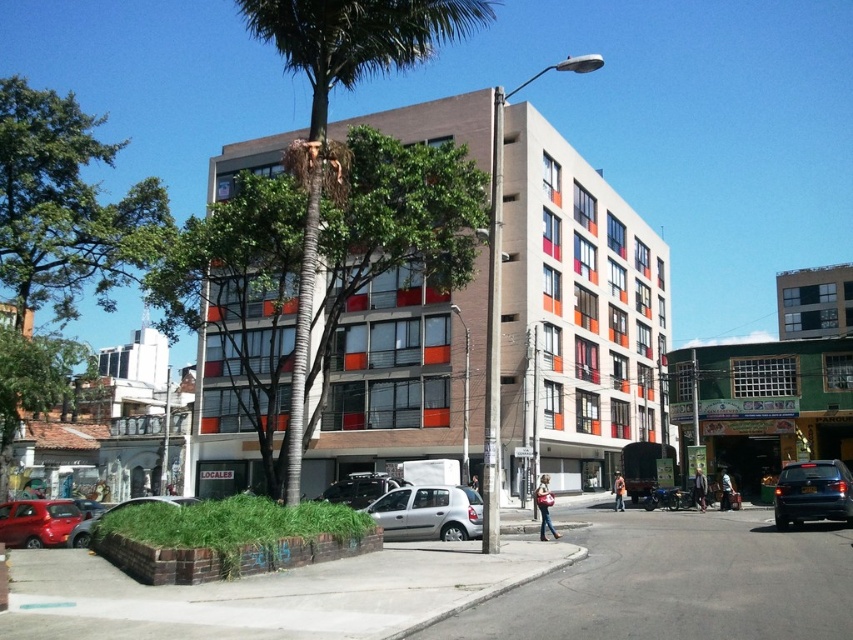
Who is taller, matte concrete building at center or silver metallic car at center?

With more height is matte concrete building at center.

Who is more distant from viewer, (646, 433) or (326, 492)?

Positioned behind is point (646, 433).

Measure the distance between point (369,435) and camera.

Point (369,435) and camera are 45.00 meters apart from each other.

This screenshot has width=853, height=640. Identify the location of matte concrete building at center. (573, 316).

Between matte red car at lower left and metallic silver car at lower left, which one is positioned lower?

metallic silver car at lower left

Is matte red car at lower left smaller than metallic silver car at lower left?

Indeed, matte red car at lower left has a smaller size compared to metallic silver car at lower left.

The height and width of the screenshot is (640, 853). What do you see at coordinates (38, 522) in the screenshot?
I see `matte red car at lower left` at bounding box center [38, 522].

The height and width of the screenshot is (640, 853). Identify the location of matte red car at lower left. (38, 522).

Can you confirm if green leafy tree at left is positioned above matte red car at lower left?

Yes, green leafy tree at left is above matte red car at lower left.

Find the location of `green leafy tree at left`. green leafy tree at left is located at coordinates (67, 205).

Is point (33, 387) in front of point (19, 547)?

No, it is behind (19, 547).

I want to click on green leafy tree at left, so click(x=67, y=205).